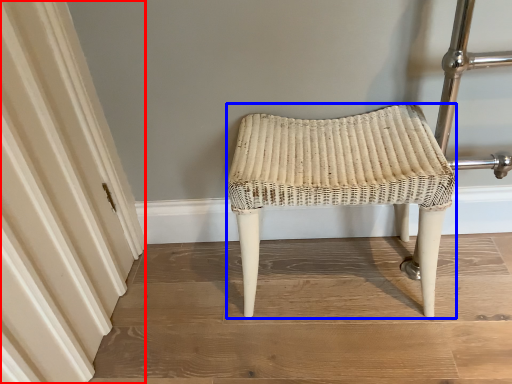
Question: Which of the following is the farthest to the observer, curtain (highlighted by a red box) or stool (highlighted by a blue box)?

Choices:
 (A) curtain
 (B) stool

Answer: (B)